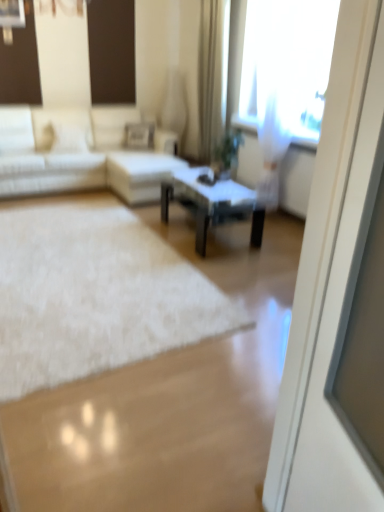
Question: Considering the positions of white fluffy rug at center and black glass coffee table at center in the image, is white fluffy rug at center taller or shorter than black glass coffee table at center?

Choices:
 (A) short
 (B) tall

Answer: (A)

Question: Looking at the image, does white fluffy rug at center seem bigger or smaller compared to black glass coffee table at center?

Choices:
 (A) big
 (B) small

Answer: (B)

Question: Which of these objects is positioned farthest from the white fabric couch at left?

Choices:
 (A) white glossy screen door at right
 (B) transparent curtain at upper right
 (C) black glass coffee table at center
 (D) beige fabric curtain at upper center
 (E) white fluffy rug at center

Answer: (A)

Question: Estimate the real-world distances between objects in this image. Which object is farther from the white glossy screen door at right?

Choices:
 (A) black glass coffee table at center
 (B) beige fabric curtain at upper center
 (C) white fluffy rug at center
 (D) transparent curtain at upper right
 (E) white fabric couch at left

Answer: (B)